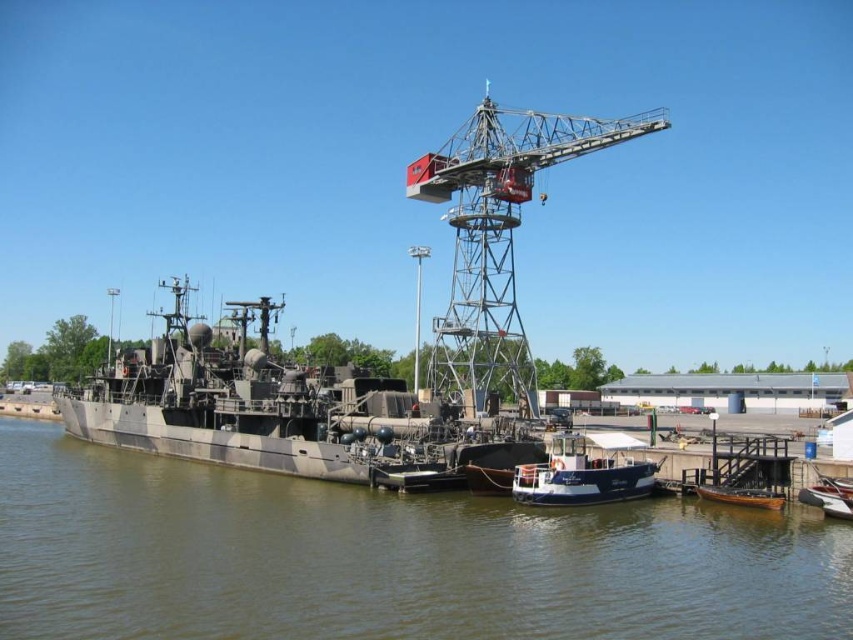
You are a ship captain planning to maneuver your vessel away from the pier. You need to ensure there is enough space between the brown matte water at center and the metallic gray crane at center to avoid collision. What is the minimum safe distance your ship should maintain while moving?

The brown matte water at center is 66.20 meters away from the metallic gray crane at center. Therefore, the ship should maintain a minimum safe distance of at least 66.20 meters to avoid collision with the metallic gray crane at center.

You are a photographer positioned on the pier and want to capture both the camouflage paint military ship at left and the white matte boat at center in a single shot. Given that your camera has a fixed focal length, which boat should you adjust your focus to ensure the one farther away is sharp?

The camouflage paint military ship at left is located above the white matte boat at center, meaning it is farther away. To ensure the farther boat is sharp, adjust focus to the camouflage paint military ship at left.

You are a crane operator who needs to lift cargo from the camouflage paint military ship at left to the wooden boat at lower right. Considering their heights, which vessel will require you to adjust the crane arm to a lower position?

The wooden boat at lower right is shorter than the camouflage paint military ship at left, so you will need to lower the crane arm more when loading cargo onto the wooden boat at lower right.